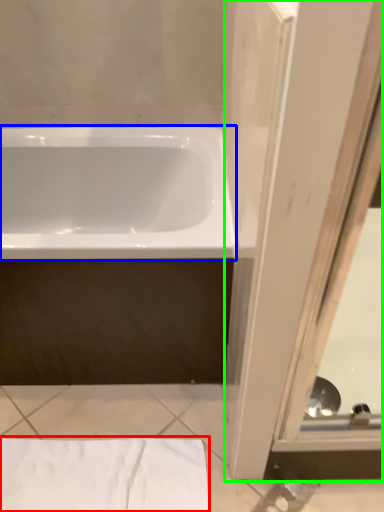
Question: Which is farther away from sheet (highlighted by a red box)? bathtub (highlighted by a blue box) or screen door (highlighted by a green box)?

Choices:
 (A) bathtub
 (B) screen door

Answer: (A)